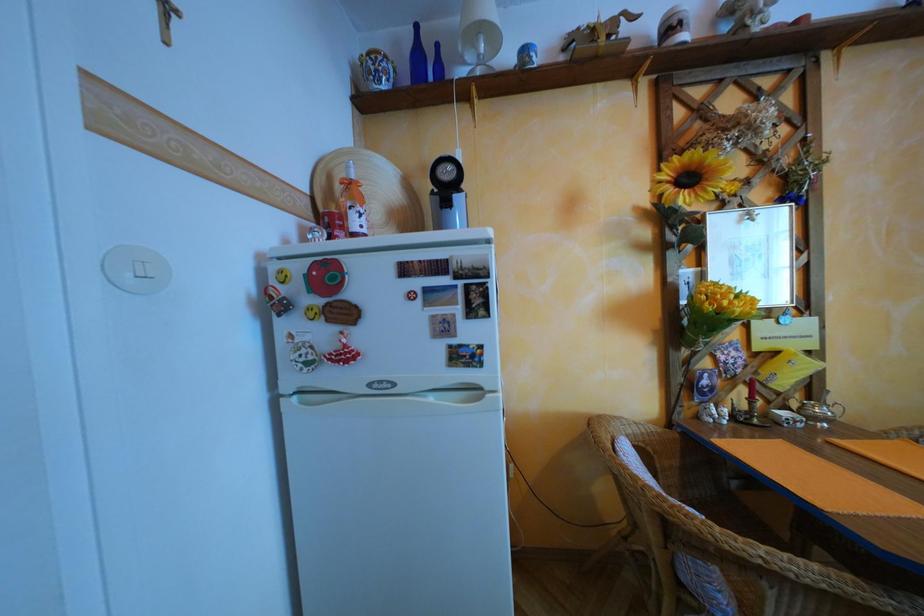
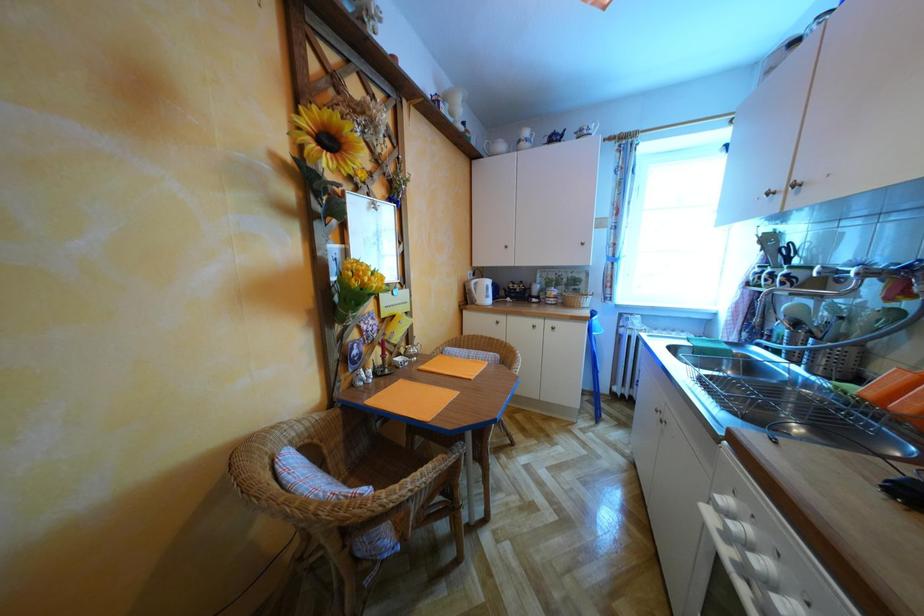
Question: Based on the continuous images, in which direction is the camera rotating? Reply with the corresponding letter.

Choices:
 (A) Left
 (B) Right
 (C) Up
 (D) Down

Answer: (B)